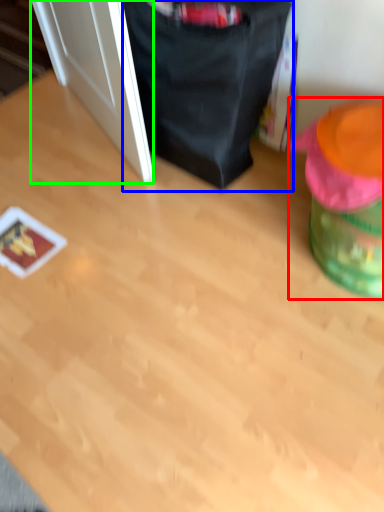
Question: Estimate the real-world distances between objects in this image. Which object is farther from bean bag chair (highlighted by a red box), bean bag chair (highlighted by a blue box) or door (highlighted by a green box)?

Choices:
 (A) bean bag chair
 (B) door

Answer: (B)